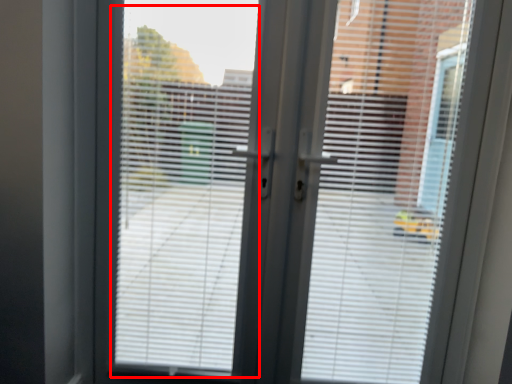
Question: From the image's perspective, where is window screen (annotated by the red box) located relative to blind?

Choices:
 (A) below
 (B) above

Answer: (B)